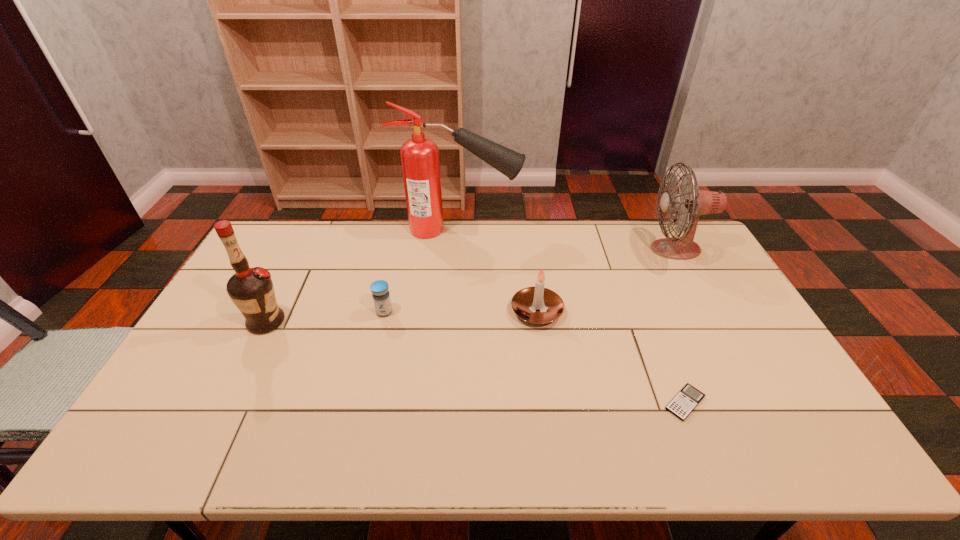
Where is `blank space located in front of the fan to direct airflow`? The width and height of the screenshot is (960, 540). blank space located in front of the fan to direct airflow is located at coordinates (550, 249).

Where is `vacant space located 0.110m in front of the fan to direct airflow`? Image resolution: width=960 pixels, height=540 pixels. vacant space located 0.110m in front of the fan to direct airflow is located at coordinates (617, 249).

I want to click on vacant space positioned 0.260m on the right of the third shortest object, so click(x=648, y=311).

This screenshot has width=960, height=540. I want to click on free region located 0.310m on the back of the medicine, so click(399, 246).

Where is `free region located 0.090m on the right of the calculator`? The image size is (960, 540). free region located 0.090m on the right of the calculator is located at coordinates (743, 403).

Identify the location of fire extinguisher at the far edge. The width and height of the screenshot is (960, 540). (420, 162).

Locate an element on the screen. The width and height of the screenshot is (960, 540). fan that is at the far edge is located at coordinates [690, 201].

Where is `object present at the left edge`? This screenshot has height=540, width=960. object present at the left edge is located at coordinates (251, 289).

Image resolution: width=960 pixels, height=540 pixels. I want to click on object at the right edge, so click(x=690, y=201).

Find the location of a particular element. object that is positioned at the far right corner is located at coordinates 690,201.